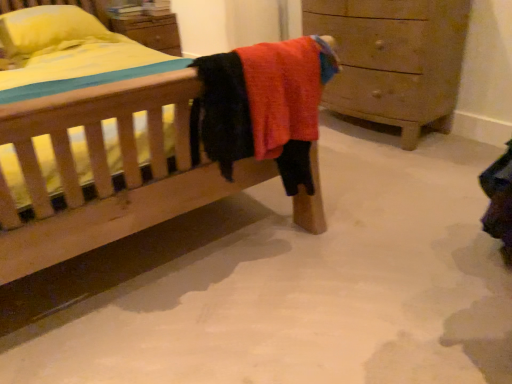
The height and width of the screenshot is (384, 512). What do you see at coordinates (394, 59) in the screenshot?
I see `wooden chest of drawers at right` at bounding box center [394, 59].

What are the coordinates of `wooden chest of drawers at right` in the screenshot? It's located at (394, 59).

The image size is (512, 384). Describe the element at coordinates (47, 28) in the screenshot. I see `yellow fabric pillow at upper left` at that location.

Locate an element on the screen. This screenshot has width=512, height=384. yellow fabric pillow at upper left is located at coordinates (47, 28).

This screenshot has height=384, width=512. Find the location of `wooden chest of drawers at right`. wooden chest of drawers at right is located at coordinates (394, 59).

Considering the relative positions of yellow fabric pillow at upper left and wooden chest of drawers at right in the image provided, is yellow fabric pillow at upper left to the left of wooden chest of drawers at right from the viewer's perspective?

Indeed, yellow fabric pillow at upper left is positioned on the left side of wooden chest of drawers at right.

Which object is further away from the camera, yellow fabric pillow at upper left or wooden chest of drawers at right?

yellow fabric pillow at upper left.

Which is in front, point (29, 26) or point (341, 89)?

Point (29, 26)

From the image's perspective, is yellow fabric pillow at upper left below wooden chest of drawers at right?

No.

From a real-world perspective, between yellow fabric pillow at upper left and wooden chest of drawers at right, who is vertically higher?

In real-world perspective, yellow fabric pillow at upper left is above.

Which object is thinner, yellow fabric pillow at upper left or wooden chest of drawers at right?

With smaller width is wooden chest of drawers at right.

Considering the sizes of yellow fabric pillow at upper left and wooden chest of drawers at right in the image, is yellow fabric pillow at upper left taller or shorter than wooden chest of drawers at right?

Considering their sizes, yellow fabric pillow at upper left has less height than wooden chest of drawers at right.

Considering the relative sizes of yellow fabric pillow at upper left and wooden chest of drawers at right in the image provided, is yellow fabric pillow at upper left bigger than wooden chest of drawers at right?

Actually, yellow fabric pillow at upper left might be smaller than wooden chest of drawers at right.

From the picture: Choose the correct answer: Is yellow fabric pillow at upper left inside wooden chest of drawers at right or outside it?

The correct answer is: outside.

Are yellow fabric pillow at upper left and wooden chest of drawers at right located far from each other?

Yes, yellow fabric pillow at upper left and wooden chest of drawers at right are located far from each other.

Based on the photo, is wooden chest of drawers at right at the back of yellow fabric pillow at upper left?

No, yellow fabric pillow at upper left's orientation is not away from wooden chest of drawers at right.

Where is `chest of drawers on the right of yellow fabric pillow at upper left`? This screenshot has height=384, width=512. chest of drawers on the right of yellow fabric pillow at upper left is located at coordinates (394, 59).

Based on their positions, is wooden chest of drawers at right located to the left or right of yellow fabric pillow at upper left?

wooden chest of drawers at right is positioned on yellow fabric pillow at upper left's right side.

Which is behind, wooden chest of drawers at right or yellow fabric pillow at upper left?

yellow fabric pillow at upper left is more distant.

Which is behind, point (342, 109) or point (52, 18)?

Positioned behind is point (342, 109).

From the image's perspective, which is below, wooden chest of drawers at right or yellow fabric pillow at upper left?

From the image's view, wooden chest of drawers at right is below.

From a real-world perspective, is wooden chest of drawers at right located higher than yellow fabric pillow at upper left?

No, from a real-world perspective, wooden chest of drawers at right is not over yellow fabric pillow at upper left

Can you confirm if wooden chest of drawers at right is wider than yellow fabric pillow at upper left?

No, wooden chest of drawers at right is not wider than yellow fabric pillow at upper left.

Which of these two, wooden chest of drawers at right or yellow fabric pillow at upper left, stands taller?

With more height is wooden chest of drawers at right.

Considering the relative sizes of wooden chest of drawers at right and yellow fabric pillow at upper left in the image provided, is wooden chest of drawers at right bigger than yellow fabric pillow at upper left?

Yes.

Would you say wooden chest of drawers at right is outside yellow fabric pillow at upper left?

Indeed, wooden chest of drawers at right is completely outside yellow fabric pillow at upper left.

Are wooden chest of drawers at right and yellow fabric pillow at upper left beside each other?

They are not placed beside each other.

Is wooden chest of drawers at right oriented away from yellow fabric pillow at upper left?

That's not correct — wooden chest of drawers at right is not looking away from yellow fabric pillow at upper left.

What are the coordinates of `chest of drawers on the right of yellow fabric pillow at upper left` in the screenshot? It's located at (394, 59).

Locate an element on the screen. pillow that appears above the wooden chest of drawers at right (from a real-world perspective) is located at coordinates (47, 28).

At what (x,y) coordinates should I click in order to perform the action: click on pillow above the wooden chest of drawers at right (from the image's perspective). Please return your answer as a coordinate pair (x, y). The image size is (512, 384). Looking at the image, I should click on (47, 28).